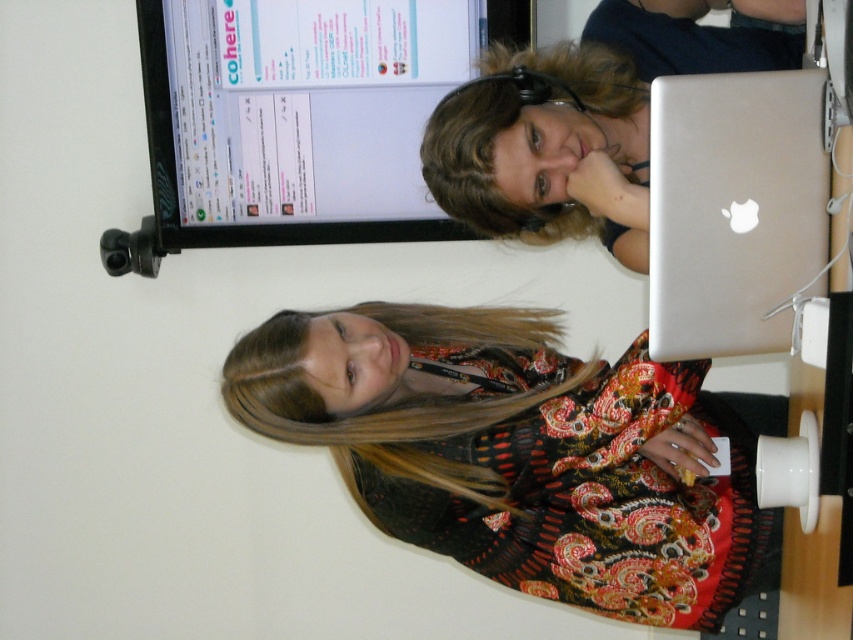
Can you confirm if printed fabric dress at center is positioned above silver metallic laptop at right?

No, printed fabric dress at center is not above silver metallic laptop at right.

Who is more distant from viewer, (358, 358) or (674, 339)?

The point (358, 358) is behind.

Where is `printed fabric dress at center`? This screenshot has width=853, height=640. printed fabric dress at center is located at coordinates (517, 451).

What do you see at coordinates (517, 451) in the screenshot? I see `printed fabric dress at center` at bounding box center [517, 451].

Between printed fabric dress at center and matte black monitor at upper center, which one has more height?

Standing taller between the two is printed fabric dress at center.

Does point (611, 577) lie behind point (210, 180)?

No, (611, 577) is in front of (210, 180).

This screenshot has height=640, width=853. I want to click on printed fabric dress at center, so click(x=517, y=451).

Can you confirm if matte black monitor at upper center is thinner than silver metallic laptop at right?

No.

Does matte black monitor at upper center have a greater width compared to silver metallic laptop at right?

Correct, the width of matte black monitor at upper center exceeds that of silver metallic laptop at right.

Is point (467, 237) closer to viewer compared to point (677, 349)?

That is False.

Image resolution: width=853 pixels, height=640 pixels. In order to click on matte black monitor at upper center in this screenshot , I will do `click(302, 115)`.